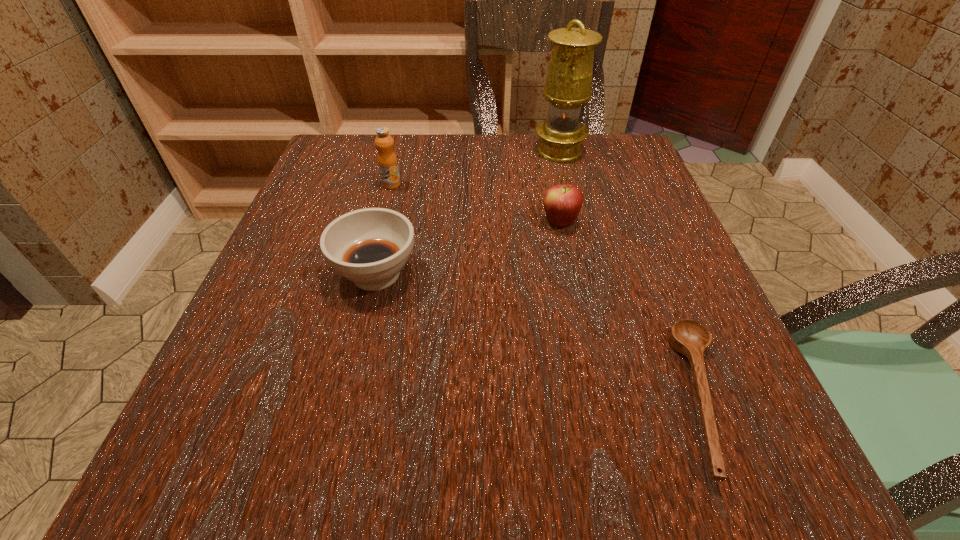
Locate an element on the screen. The height and width of the screenshot is (540, 960). free location located 0.190m on the back of the apple is located at coordinates (547, 162).

The image size is (960, 540). I want to click on free space located 0.310m on the right of the fourth tallest object, so click(598, 274).

Find the location of `vacant space located 0.220m on the left of the rightmost object`. vacant space located 0.220m on the left of the rightmost object is located at coordinates (511, 397).

Where is `oil lamp present at the far edge`? The image size is (960, 540). oil lamp present at the far edge is located at coordinates (568, 85).

Find the location of a particular element. This screenshot has height=540, width=960. orange juice that is positioned at the far edge is located at coordinates (387, 161).

At what (x,y) coordinates should I click in order to perform the action: click on object that is at the near edge. Please return your answer as a coordinate pair (x, y). Looking at the image, I should click on (687, 337).

This screenshot has height=540, width=960. I want to click on orange juice that is at the left edge, so click(387, 161).

I want to click on soup bowl present at the left edge, so 370,246.

Where is `oil lamp located in the right edge section of the desktop`? oil lamp located in the right edge section of the desktop is located at coordinates 568,85.

Locate an element on the screen. This screenshot has height=540, width=960. wooden spoon positioned at the right edge is located at coordinates (687, 337).